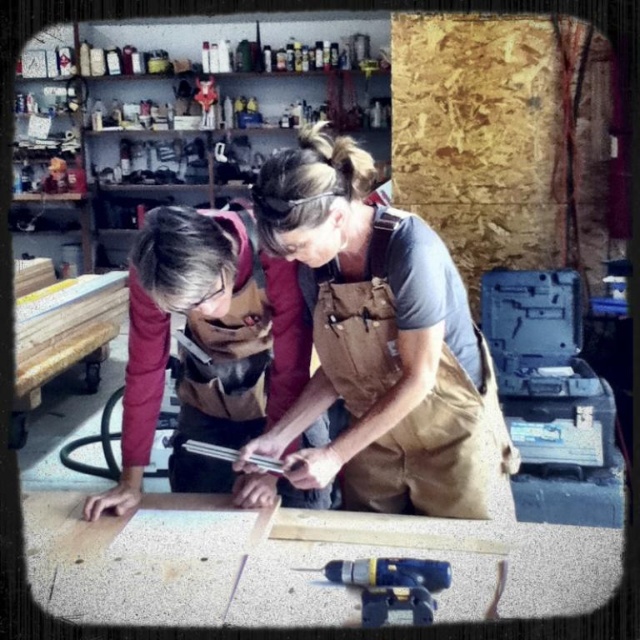
Does brown canvas apron at center have a lesser height compared to yellow plastic drill at lower center?

No, brown canvas apron at center is not shorter than yellow plastic drill at lower center.

Which is behind, point (410, 492) or point (376, 577)?

The point (410, 492) is more distant.

Identify the location of brown canvas apron at center. (380, 342).

Between brown canvas apron at center and matte brown apron at center, which one appears on the right side from the viewer's perspective?

From the viewer's perspective, brown canvas apron at center appears more on the right side.

Does point (388, 388) lie behind point (189, 477)?

No, (388, 388) is closer to viewer.

Locate an element on the screen. This screenshot has height=640, width=640. brown canvas apron at center is located at coordinates (380, 342).

Is matte brown apron at center positioned behind yellow plastic drill at lower center?

Yes, it is behind yellow plastic drill at lower center.

This screenshot has height=640, width=640. Describe the element at coordinates (205, 337) in the screenshot. I see `matte brown apron at center` at that location.

Find the location of a particular element. matte brown apron at center is located at coordinates (205, 337).